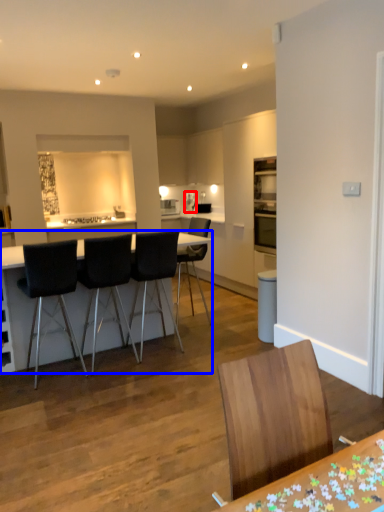
Question: Which of the following is the farthest to the observer, kitchen appliance (highlighted by a red box) or table (highlighted by a blue box)?

Choices:
 (A) kitchen appliance
 (B) table

Answer: (A)